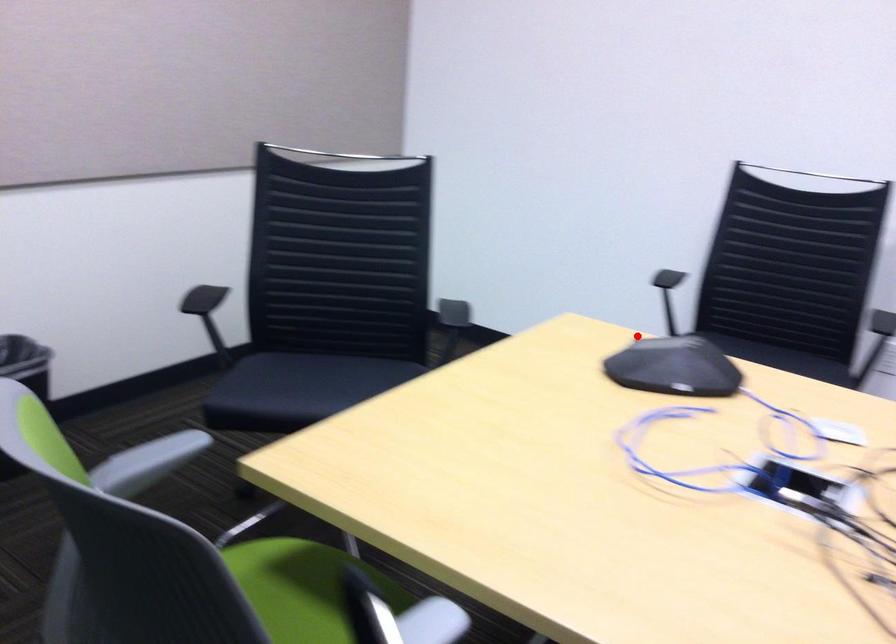
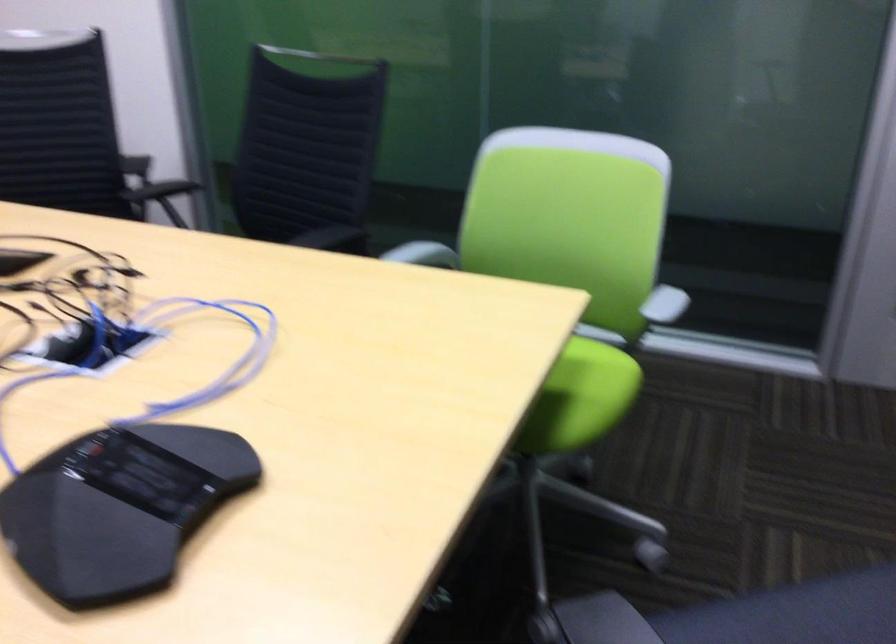
Question: I am providing you with two images of the same scene from different viewpoints. In image1, a red point is highlighted. Considering the same 3D point in image2, which of the following is correct?

Choices:
 (A) It is closer
 (B) It is farther

Answer: (A)